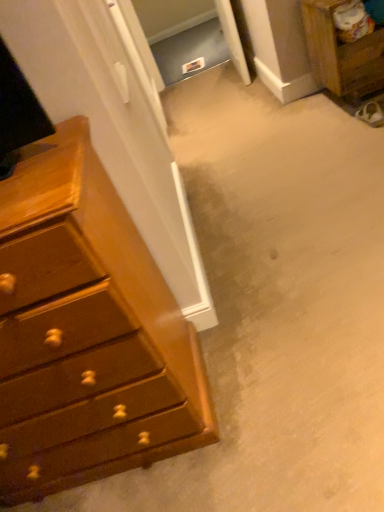
Question: Considering the relative positions of wooden nightstand at upper right and shiny brown dresser at left in the image provided, is wooden nightstand at upper right to the left or to the right of shiny brown dresser at left?

Choices:
 (A) right
 (B) left

Answer: (A)

Question: From a real-world perspective, is wooden nightstand at upper right positioned above or below shiny brown dresser at left?

Choices:
 (A) below
 (B) above

Answer: (A)

Question: Considering the positions of wooden nightstand at upper right and shiny brown dresser at left in the image, is wooden nightstand at upper right taller or shorter than shiny brown dresser at left?

Choices:
 (A) tall
 (B) short

Answer: (B)

Question: Is shiny brown dresser at left inside the boundaries of wooden nightstand at upper right, or outside?

Choices:
 (A) outside
 (B) inside

Answer: (A)

Question: From their relative heights in the image, would you say shiny brown dresser at left is taller or shorter than wooden nightstand at upper right?

Choices:
 (A) short
 (B) tall

Answer: (B)

Question: From a real-world perspective, is shiny brown dresser at left above or below wooden nightstand at upper right?

Choices:
 (A) above
 (B) below

Answer: (A)

Question: Is point (69, 354) positioned closer to the camera than point (347, 75)?

Choices:
 (A) farther
 (B) closer

Answer: (B)